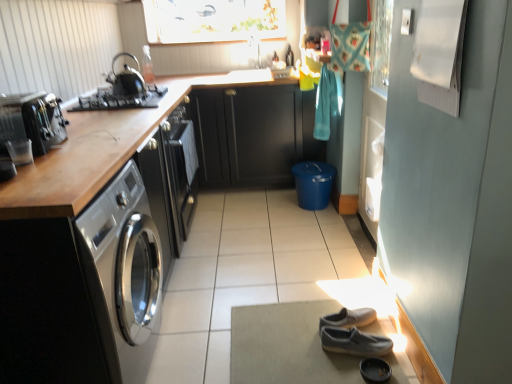
At what (x,y) coordinates should I click in order to perform the action: click on gray suede shoes at lower right. Please return your answer as a coordinate pair (x, y). The image size is (512, 384). Looking at the image, I should click on (354, 342).

The image size is (512, 384). What do you see at coordinates (354, 342) in the screenshot? I see `gray suede shoes at lower right` at bounding box center [354, 342].

At what (x,y) coordinates should I click in order to perform the action: click on matte glass window screen at upper center. Please return your answer as a coordinate pair (x, y). This screenshot has width=512, height=384. Looking at the image, I should click on (213, 20).

What do you see at coordinates (120, 100) in the screenshot?
I see `black matte gas stove at upper left` at bounding box center [120, 100].

What do you see at coordinates (32, 121) in the screenshot? This screenshot has width=512, height=384. I see `satin black toaster at left` at bounding box center [32, 121].

Identify the location of satin black cabinet at left, which appears as the second cabinetry when viewed from the back. (68, 243).

The height and width of the screenshot is (384, 512). I want to click on dark wood cabinet at center, positioned as the 2th cabinetry in front-to-back order, so pos(247,134).

In order to click on gray suede shoes at lower right in this screenshot , I will do `click(354, 342)`.

In the scene shown: Between black leather shoe at lower center and shiny black kettle at upper left, which one has more height?

shiny black kettle at upper left.

Does point (370, 363) come in front of point (124, 53)?

Yes, point (370, 363) is closer to viewer.

Is black leather shoe at lower center bigger or smaller than shiny black kettle at upper left?

In the image, black leather shoe at lower center appears to be smaller than shiny black kettle at upper left.

What's the angular difference between black leather shoe at lower center and gray suede shoes at lower center's facing directions?

The angular difference between black leather shoe at lower center and gray suede shoes at lower center is 16.2 degrees.

Considering the relative sizes of black leather shoe at lower center and gray suede shoes at lower center in the image provided, is black leather shoe at lower center thinner than gray suede shoes at lower center?

Correct, the width of black leather shoe at lower center is less than that of gray suede shoes at lower center.

Looking at this image, is black leather shoe at lower center facing towards gray suede shoes at lower center?

Yes, black leather shoe at lower center faces towards gray suede shoes at lower center.

From a real-world perspective, which object stands above the other?

black leather shoe at lower center is physically above.

Is matte glass window screen at upper center bigger or smaller than satin black toaster at left?

Clearly, matte glass window screen at upper center is larger in size than satin black toaster at left.

Relative to satin black toaster at left, is matte glass window screen at upper center in front or behind?

Clearly, matte glass window screen at upper center is behind satin black toaster at left.

Considering the positions of points (214, 37) and (38, 135), is point (214, 37) closer to camera compared to point (38, 135)?

No, it is behind (38, 135).

From a real-world perspective, between matte glass window screen at upper center and satin black toaster at left, who is vertically lower?

In real-world perspective, satin black toaster at left is lower.

Which is less distant, [345,347] or [50,120]?

Point [345,347] is positioned farther from the camera compared to point [50,120].

Is gray suede shoes at lower right to the left of satin black toaster at left from the viewer's perspective?

No, gray suede shoes at lower right is not to the left of satin black toaster at left.

From their relative heights in the image, would you say gray suede shoes at lower right is taller or shorter than satin black toaster at left?

gray suede shoes at lower right is shorter than satin black toaster at left.

From a real-world perspective, between gray suede shoes at lower right and satin black toaster at left, who is vertically higher?

satin black toaster at left, from a real-world perspective.

Is point (92, 259) farther from camera compared to point (362, 362)?

No, (92, 259) is closer to viewer.

From the image's perspective, is sleek stainless steel washing machine at left under black leather shoe at lower center?

Actually, sleek stainless steel washing machine at left appears above black leather shoe at lower center in the image.

Does sleek stainless steel washing machine at left appear on the left side of black leather shoe at lower center?

Correct, you'll find sleek stainless steel washing machine at left to the left of black leather shoe at lower center.

From the picture: What's the angular difference between gray suede shoes at lower center and black matte gas stove at upper left's facing directions?

gray suede shoes at lower center and black matte gas stove at upper left are facing 85.1 degrees away from each other.

In the scene shown: Considering the sizes of objects gray suede shoes at lower center and black matte gas stove at upper left in the image provided, who is wider, gray suede shoes at lower center or black matte gas stove at upper left?

Wider between the two is gray suede shoes at lower center.

Which object is positioned more to the right, gray suede shoes at lower center or black matte gas stove at upper left?

gray suede shoes at lower center.

Between gray suede shoes at lower center and black matte gas stove at upper left, which one has more height?

Standing taller between the two is black matte gas stove at upper left.

Does point (247, 143) come farther from viewer compared to point (150, 90)?

That is True.

From the image's perspective, which one is positioned lower, dark wood cabinet at center, positioned as the 2th cabinetry in front-to-back order, or black matte gas stove at upper left?

dark wood cabinet at center, positioned as the 2th cabinetry in front-to-back order.

Is dark wood cabinet at center, the first cabinetry when ordered from back to front, aimed at black matte gas stove at upper left?

No, dark wood cabinet at center, the first cabinetry when ordered from back to front, is not oriented towards black matte gas stove at upper left.

Where is `kitchen appliance behind the black leather shoe at lower center`? kitchen appliance behind the black leather shoe at lower center is located at coordinates (126, 79).

I want to click on plain that appears below the black leather shoe at lower center (from a real-world perspective), so click(x=286, y=345).

Looking at the image, which one is located closer to black leather shoe at lower center, gray suede shoes at lower right or satin black cabinet at left, which appears as the second cabinetry when viewed from the back?

gray suede shoes at lower right lies closer to black leather shoe at lower center than the other object.

When comparing their distances from matte glass window screen at upper center, does sleek stainless steel washing machine at left or gray suede shoes at lower right seem further?

gray suede shoes at lower right lies further to matte glass window screen at upper center than the other object.

Considering their positions, is gray suede shoes at lower right positioned further to shiny black kettle at upper left than black leather shoe at lower center?

black leather shoe at lower center lies further to shiny black kettle at upper left than the other object.

Considering their positions, is black matte gas stove at upper left positioned closer to sleek stainless steel washing machine at left than gray suede shoes at lower right?

gray suede shoes at lower right is positioned closer to the anchor sleek stainless steel washing machine at left.

Which object lies further to the anchor point black leather shoe at lower center, black matte gas stove at upper left or sleek stainless steel washing machine at left?

black matte gas stove at upper left.

Estimate the real-world distances between objects in this image. Which object is further from shiny black kettle at upper left, gray suede shoes at lower center or dark wood cabinet at center, the first cabinetry when ordered from back to front?

The object further to shiny black kettle at upper left is gray suede shoes at lower center.

Considering their positions, is shiny black kettle at upper left positioned further to black leather shoe at lower center than satin black cabinet at left, acting as the first cabinetry starting from the front?

shiny black kettle at upper left is positioned further to the anchor black leather shoe at lower center.

Considering their positions, is black matte gas stove at upper left positioned closer to sleek stainless steel washing machine at left than satin black toaster at left?

The object closer to sleek stainless steel washing machine at left is satin black toaster at left.

What are the coordinates of `footwear between sleek stainless steel washing machine at left and dark wood cabinet at center, the first cabinetry when ordered from back to front, from front to back` in the screenshot? It's located at (354, 342).

Identify the location of gas stove located between black leather shoe at lower center and dark wood cabinet at center, positioned as the 2th cabinetry in front-to-back order, in the depth direction. tap(120, 100).

Identify the location of cabinetry between black leather shoe at lower center and dark wood cabinet at center, the first cabinetry when ordered from back to front, from front to back. The image size is (512, 384). (68, 243).

The image size is (512, 384). What are the coordinates of `washing machine that lies between black matte gas stove at upper left and black leather shoe at lower center from top to bottom` in the screenshot? It's located at pyautogui.click(x=123, y=271).